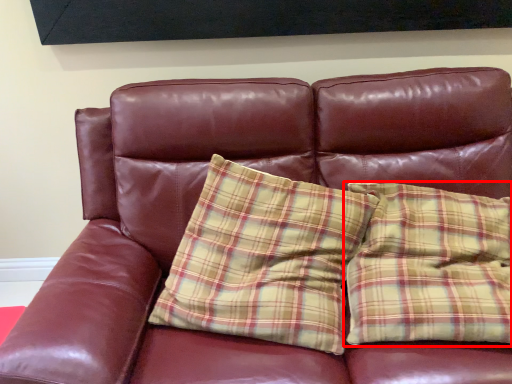
Question: From the image, what is the correct spatial relationship of pillow (annotated by the red box) in relation to pillow?

Choices:
 (A) right
 (B) left

Answer: (A)